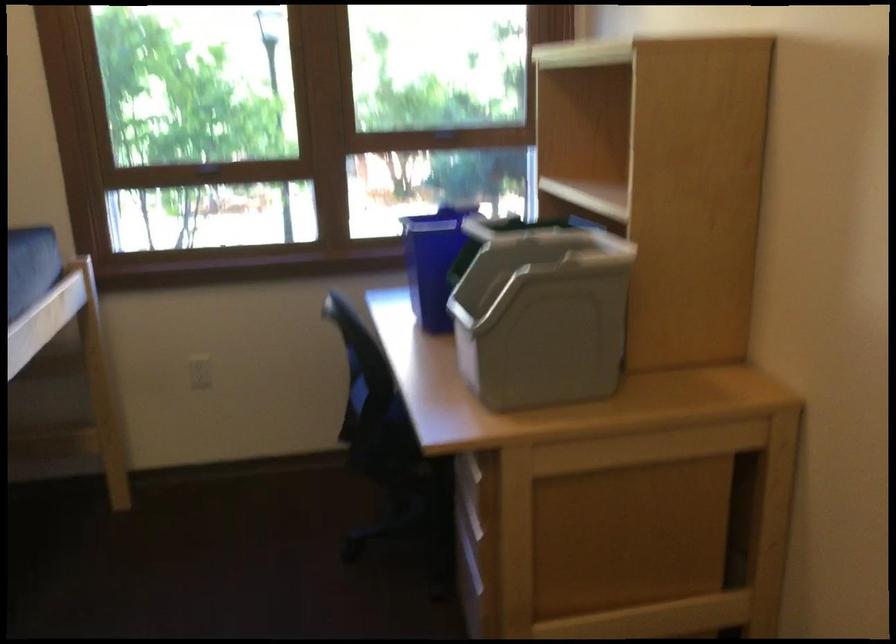
The width and height of the screenshot is (896, 644). I want to click on blue recycling bin, so click(433, 261).